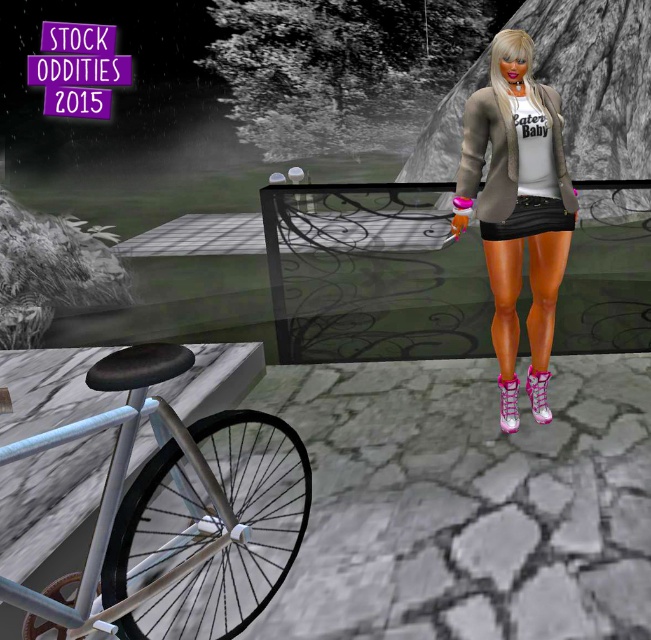
Between pink glittery boot at lower right and pink suede boot at lower center, which one is positioned lower?

pink suede boot at lower center is below.

Is point (529, 381) farther from camera compared to point (499, 419)?

Yes, point (529, 381) is farther from viewer.

What do you see at coordinates (538, 394) in the screenshot? I see `pink glittery boot at lower right` at bounding box center [538, 394].

I want to click on pink glittery boot at lower right, so click(x=538, y=394).

Consider the image. Can you confirm if black matte skirt at center is positioned to the right of pink glittery boot at lower right?

No, black matte skirt at center is not to the right of pink glittery boot at lower right.

In the scene shown: Does black matte skirt at center appear under pink glittery boot at lower right?

No, black matte skirt at center is not below pink glittery boot at lower right.

Is point (551, 204) positioned behind point (544, 419)?

That is False.

Locate an element on the screen. Image resolution: width=651 pixels, height=640 pixels. black matte skirt at center is located at coordinates (529, 220).

Who is lower down, black matte skirt at center or pink suede boot at lower center?

Positioned lower is pink suede boot at lower center.

From the picture: Who is shorter, black matte skirt at center or pink suede boot at lower center?

With less height is black matte skirt at center.

Is point (523, 200) positioned behind point (508, 417)?

No, (523, 200) is in front of (508, 417).

I want to click on black matte skirt at center, so click(529, 220).